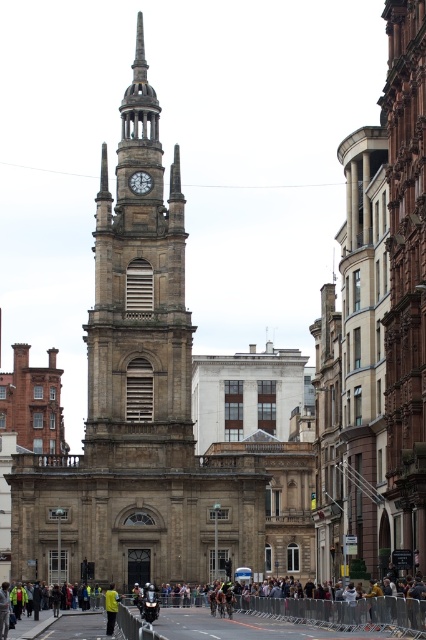
You are a photographer standing at the back of the crowd. You want to take a photo of the historic stone church tower. However, the multicolored fabric crowd at center and the yellow fabric jacket at center are blocking your view. Which object is closer to you and might be easier to move for a better shot?

The multicolored fabric crowd at center is below the yellow fabric jacket at center, meaning the yellow fabric jacket at center is closer to you. Therefore, moving the yellow fabric jacket at center would provide a clearer view of the church tower.

You are standing in the bustling urban scene and see the brown stone clock tower at center. Can you tell me the location of the point with coordinates point (138, 301)?

The point (138, 301) is on the brown stone clock tower at center.

In the scene shown: You are a photographer standing at the base of the historic stone church tower. You want to capture the crowd in front of the tower, specifically focusing on the yellow fabric jacket at center. Where should you position your camera to ensure the jacket is centered in your shot?

To center the yellow fabric jacket at center in your shot, position your camera directly in line with the jacket located at point 0.950 on the horizontal axis and 0.261 on the vertical axis.